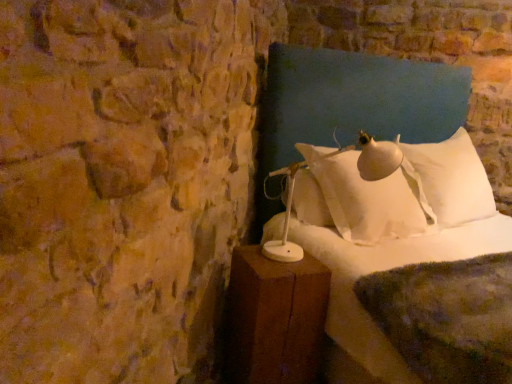
Question: Does brown wooden nightstand at lower right come behind white soft pillow at upper right?

Choices:
 (A) no
 (B) yes

Answer: (A)

Question: From the image's perspective, is brown wooden nightstand at lower right over white soft pillow at upper right?

Choices:
 (A) no
 (B) yes

Answer: (A)

Question: Is brown wooden nightstand at lower right at the left side of white soft pillow at upper right?

Choices:
 (A) no
 (B) yes

Answer: (B)

Question: Is the surface of brown wooden nightstand at lower right in direct contact with white soft pillow at upper right?

Choices:
 (A) yes
 (B) no

Answer: (B)

Question: Can you confirm if brown wooden nightstand at lower right is taller than white soft pillow at upper right?

Choices:
 (A) no
 (B) yes

Answer: (A)

Question: From a real-world perspective, is brown wooden nightstand at lower right below white soft pillow at upper right?

Choices:
 (A) yes
 (B) no

Answer: (A)

Question: Is white soft bed at center behind brown wooden nightstand at lower right?

Choices:
 (A) no
 (B) yes

Answer: (A)

Question: Does white soft bed at center appear on the right side of brown wooden nightstand at lower right?

Choices:
 (A) no
 (B) yes

Answer: (B)

Question: Can you confirm if white soft bed at center is wider than brown wooden nightstand at lower right?

Choices:
 (A) no
 (B) yes

Answer: (B)

Question: Is white soft bed at center facing towards brown wooden nightstand at lower right?

Choices:
 (A) no
 (B) yes

Answer: (A)

Question: From a real-world perspective, is white soft bed at center located higher than brown wooden nightstand at lower right?

Choices:
 (A) no
 (B) yes

Answer: (B)

Question: Is white soft bed at center turned away from brown wooden nightstand at lower right?

Choices:
 (A) yes
 (B) no

Answer: (B)

Question: Is white soft bed at center at the right side of white soft pillow at upper right?

Choices:
 (A) no
 (B) yes

Answer: (B)